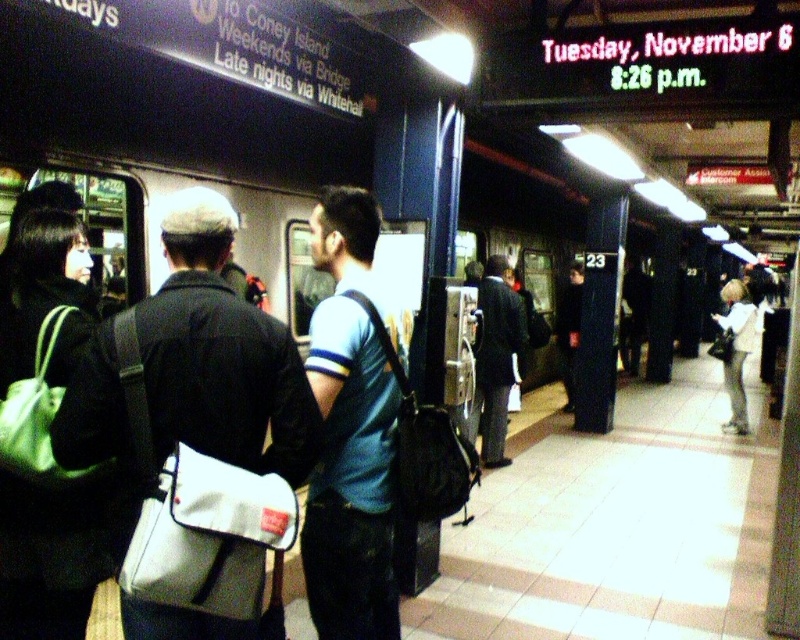
Question: Can you confirm if white fabric bag at center is smaller than blue fabric backpack at center?

Choices:
 (A) yes
 (B) no

Answer: (A)

Question: Is white fabric bag at center to the left of dark blue suit at center from the viewer's perspective?

Choices:
 (A) no
 (B) yes

Answer: (B)

Question: Is white fabric bag at center further to the viewer compared to light beige jacket at right?

Choices:
 (A) no
 (B) yes

Answer: (A)

Question: Among these objects, which one is nearest to the camera?

Choices:
 (A) blue fabric backpack at center
 (B) dark blue suit at center
 (C) light beige jacket at right

Answer: (A)

Question: Which point appears closest to the camera in this image?

Choices:
 (A) (745, 403)
 (B) (478, 424)
 (C) (318, 342)
 (D) (270, 355)

Answer: (D)

Question: Which is nearer to the dark blue suit at center?

Choices:
 (A) light beige jacket at right
 (B) white fabric bag at center
 (C) blue fabric backpack at center

Answer: (A)